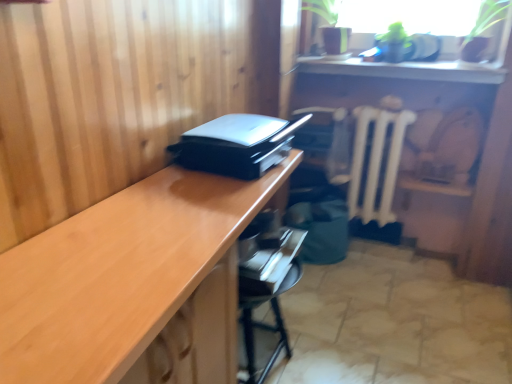
This screenshot has height=384, width=512. Identify the location of empty space that is ontop of glossy wood desk at center. (165, 224).